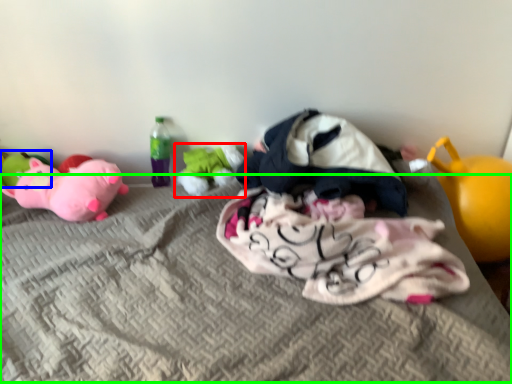
Question: Based on their relative distances, which object is farther from toy (highlighted by a red box)? Choose from toy (highlighted by a blue box) and mattress (highlighted by a green box).

Choices:
 (A) toy
 (B) mattress

Answer: (A)